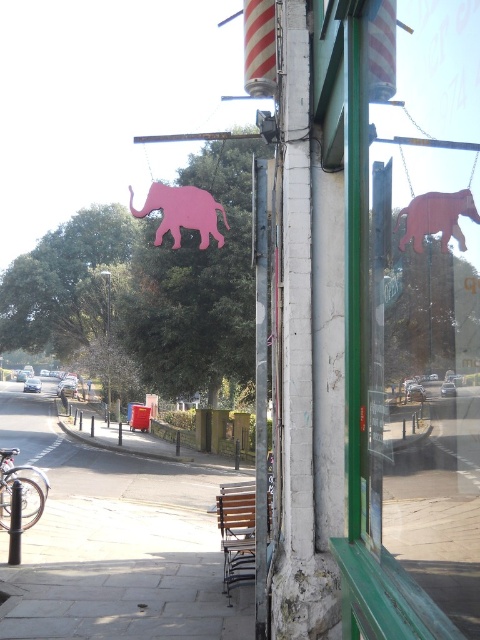
You are a delivery person trying to avoid hitting the pink matte elephant at upper center and the wooden elephant at upper right with your cart. Which of the two elephants do you need to be more cautious of in terms of height?

The pink matte elephant at upper center is taller than the wooden elephant at upper right, so you need to be more cautious of the pink matte elephant at upper center to avoid hitting it with your cart.

You are a delivery person trying to park your 1.2 meter wide cart on the paved concrete sidewalk at lower left. The pink matte elephant at upper center is hanging above the sidewalk. Can your cart fit on the sidewalk without touching the elephant?

The paved concrete sidewalk at lower left is wider than the pink matte elephant at upper center. Since the sidewalk is wider, your cart which is 1.2 meters wide can fit on the sidewalk without touching the elephant.

You are standing on the paved concrete sidewalk at lower left and want to take a photo of the storefront on the right side of the frame. If your camera is 1.5 meters tall, will you be able to see the green framed window in your camera view?

The paved concrete sidewalk at lower left and camera are 5.73 meters apart. Since the camera is 1.5 meters tall, you can see the green framed window in your camera view as there is no obstruction mentioned in the scene description.